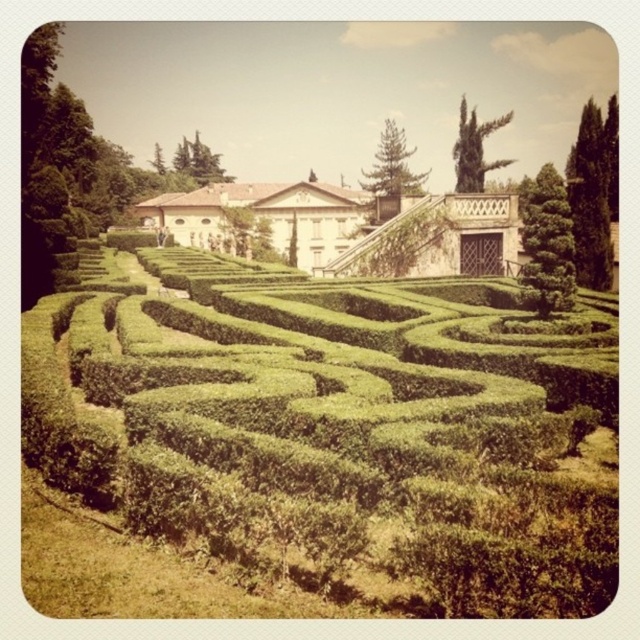
Does green hedge maze at center have a greater height compared to green leafy bush at right?

Incorrect, green hedge maze at center's height is not larger of green leafy bush at right's.

Between green hedge maze at center and green leafy bush at right, which one is positioned lower?

green hedge maze at center

Who is more distant from viewer, (305, 547) or (531, 232)?

Point (531, 232)

Identify the location of green hedge maze at center. The image size is (640, 640). (336, 428).

How much distance is there between white stone palace at center and green leafy bush at right?

white stone palace at center is 30.59 meters away from green leafy bush at right.

Who is positioned more to the right, white stone palace at center or green leafy bush at right?

green leafy bush at right

This screenshot has height=640, width=640. In order to click on white stone palace at center in this screenshot , I will do `click(353, 227)`.

Image resolution: width=640 pixels, height=640 pixels. Find the location of `white stone palace at center`. white stone palace at center is located at coordinates (353, 227).

Which of these two, green hedge maze at center or white stone palace at center, stands shorter?

green hedge maze at center is shorter.

Is point (209, 289) closer to camera compared to point (486, 273)?

Yes, it is in front of point (486, 273).

You are a GUI agent. You are given a task and a screenshot of the screen. Output one action in this format:
    pyautogui.click(x=<x>, y=<y>)
    Task: Click on the green hedge maze at center
    The image size is (640, 640).
    Given the screenshot: What is the action you would take?
    pyautogui.click(x=336, y=428)